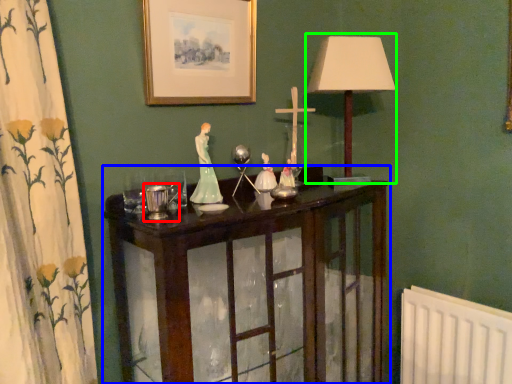
Question: Which object is positioned closest to candle holder (highlighted by a red box)? Select from furniture (highlighted by a blue box) and table lamp (highlighted by a green box).

Choices:
 (A) furniture
 (B) table lamp

Answer: (A)